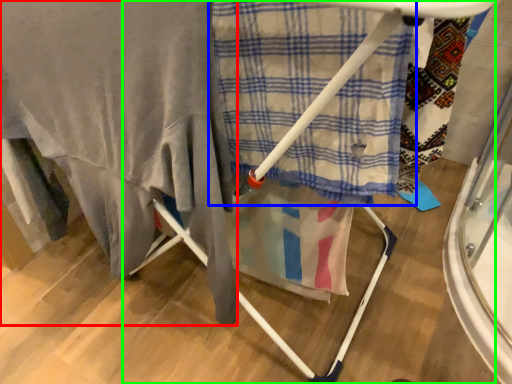
Question: Which is nearer to the blanket (highlighted by a red box)? cloth (highlighted by a blue box) or furniture (highlighted by a green box).

Choices:
 (A) cloth
 (B) furniture

Answer: (A)